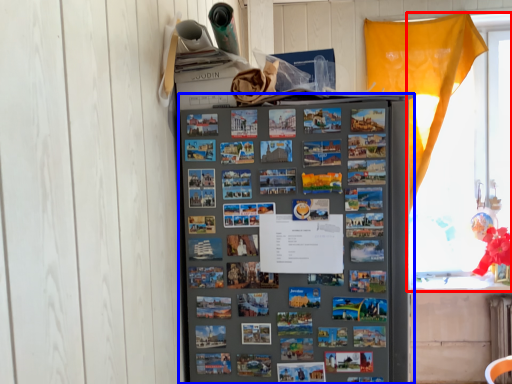
Question: Which object appears closest to the camera in this image, window (highlighted by a red box) or refrigerator (highlighted by a blue box)?

Choices:
 (A) window
 (B) refrigerator

Answer: (B)